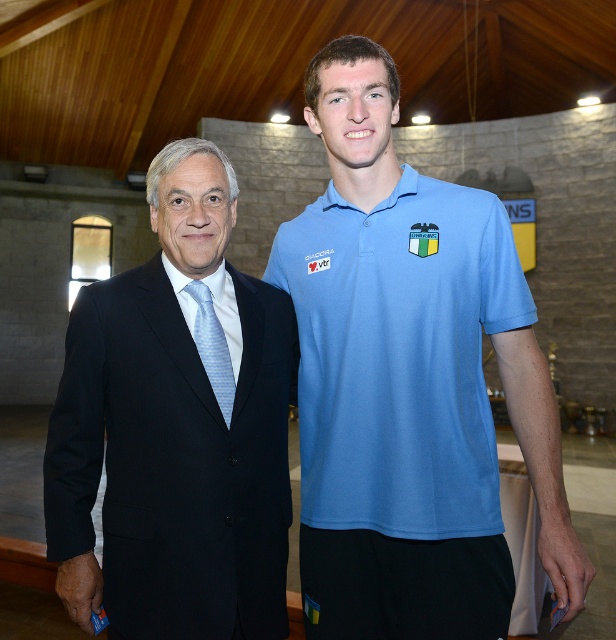
In the scene shown: Measure the distance between black suit at left and light blue striped tie at left.

They are 7.91 inches apart.

Which is behind, point (259, 483) or point (197, 328)?

The point (259, 483) is more distant.

Locate an element on the screen. Image resolution: width=616 pixels, height=640 pixels. black suit at left is located at coordinates (176, 428).

This screenshot has width=616, height=640. I want to click on black suit at left, so click(x=176, y=428).

Is blue cotton polo shirt at center behind light blue striped tie at left?

No, blue cotton polo shirt at center is closer to the viewer.

Based on the photo, does blue cotton polo shirt at center have a greater width compared to light blue striped tie at left?

Yes.

Locate an element on the screen. blue cotton polo shirt at center is located at coordinates (410, 381).

Image resolution: width=616 pixels, height=640 pixels. Identify the location of blue cotton polo shirt at center. (410, 381).

Looking at this image, can you confirm if black suit at left is thinner than light blue silk tie at left?

No.

Can you confirm if black suit at left is taller than light blue silk tie at left?

Correct, black suit at left is much taller as light blue silk tie at left.

Is point (261, 460) farther from camera compared to point (224, 317)?

No.

Where is `black suit at left`? black suit at left is located at coordinates (176, 428).